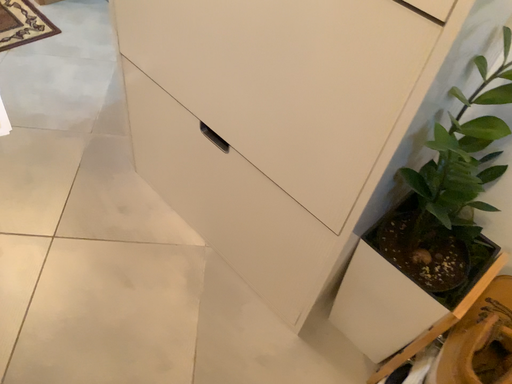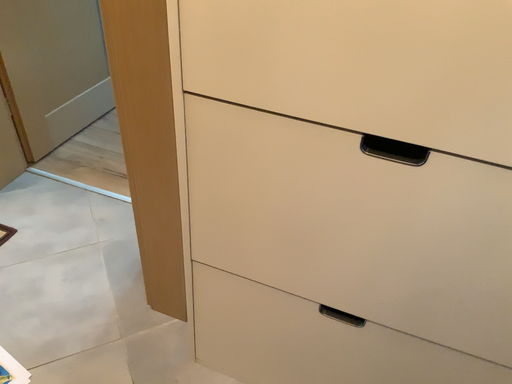
Question: How did the camera likely rotate when shooting the video?

Choices:
 (A) rotated left
 (B) rotated right

Answer: (B)